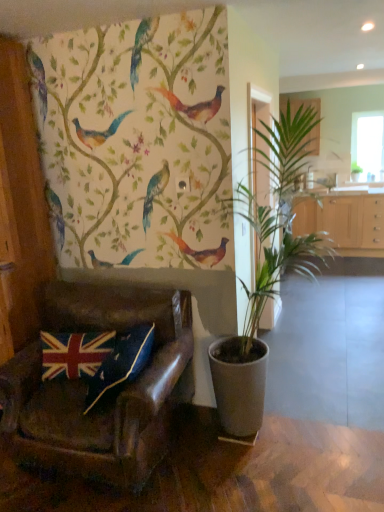
Question: Is leather at left taller or shorter than transparent glass window at upper right?

Choices:
 (A) short
 (B) tall

Answer: (A)

Question: Is point (150, 415) closer or farther from the camera than point (374, 142)?

Choices:
 (A) farther
 (B) closer

Answer: (B)

Question: Which of these objects is positioned closest to the blue velvet pillow at lower left, acting as the second pillow starting from the left?

Choices:
 (A) green leafy plant at center, which is the 2th houseplant in bottom-to-top order
 (B) green leafy plant at center, placed as the second houseplant when sorted from right to left
 (C) leather at left
 (D) light wood cabinet at center, the 1th cabinetry when ordered from bottom to top
 (E) velvet union jack pillow at lower left, which is the second pillow in right-to-left order

Answer: (E)

Question: Which is farther from the light wood cabinet at center, the 1th cabinetry when ordered from bottom to top?

Choices:
 (A) velvet union jack pillow at lower left, marked as the 1th pillow in a left-to-right arrangement
 (B) blue velvet pillow at lower left, the 1th pillow when ordered from right to left
 (C) wooden cabinet at upper right, the second cabinetry from the bottom
 (D) green leafy plant at center, the first houseplant viewed from the left
 (E) green leafy plant at center, acting as the 1th houseplant starting from the back

Answer: (A)